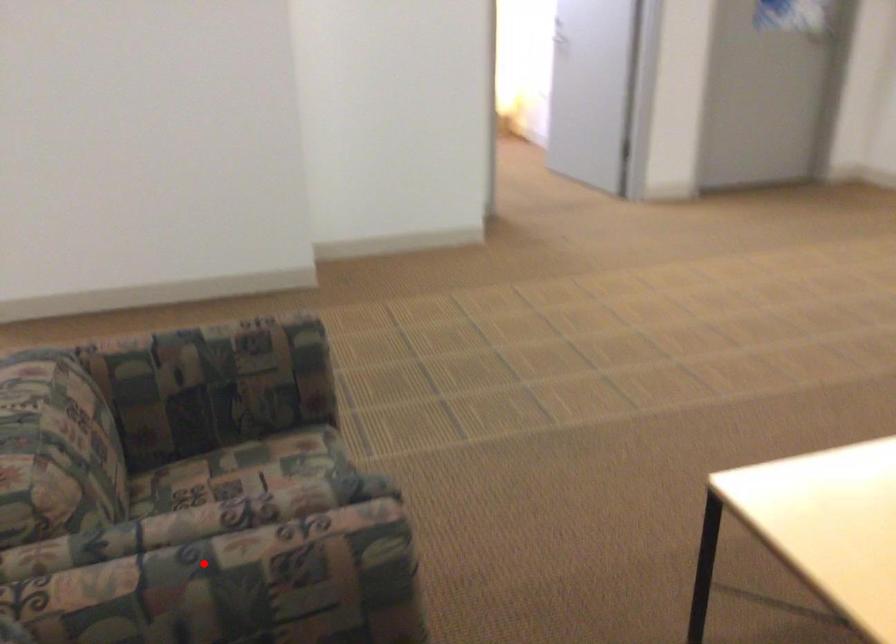
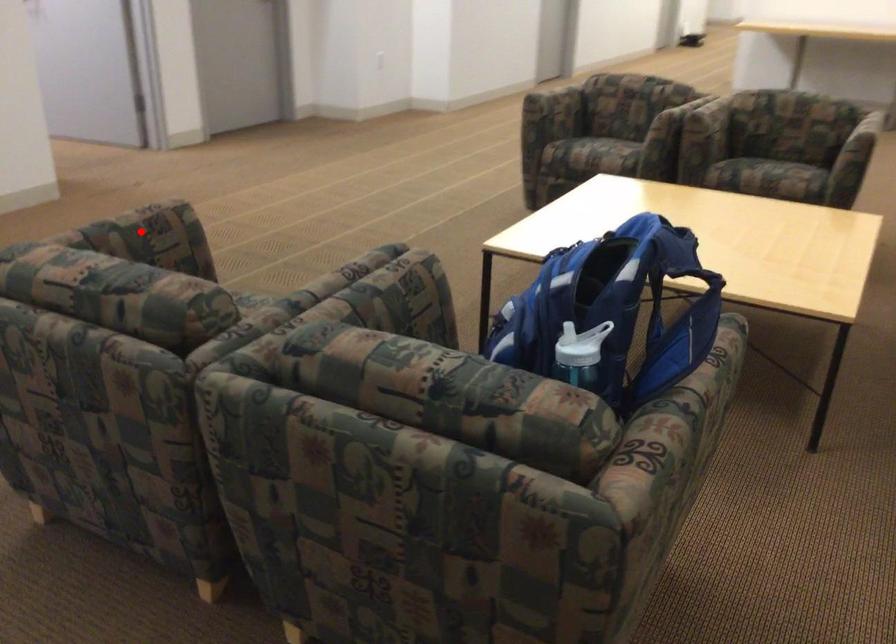
I am providing you with two images of the same scene from different viewpoints. A red point is marked on the first image and another point is marked on the second image. Is the marked point in image1 the same physical position as the marked point in image2?

No